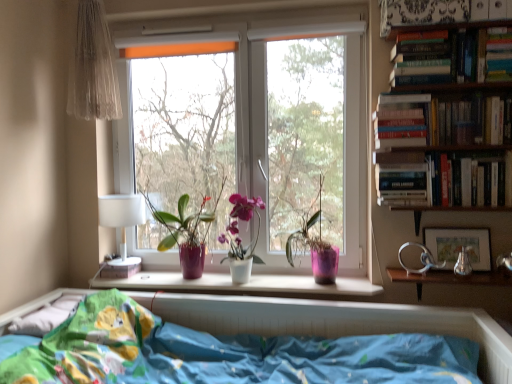
Locate an element on the screen. This screenshot has width=512, height=384. vacant space underneath pink matte pot at center, acting as the third houseplant starting from the left (from a real-world perspective) is located at coordinates (303, 284).